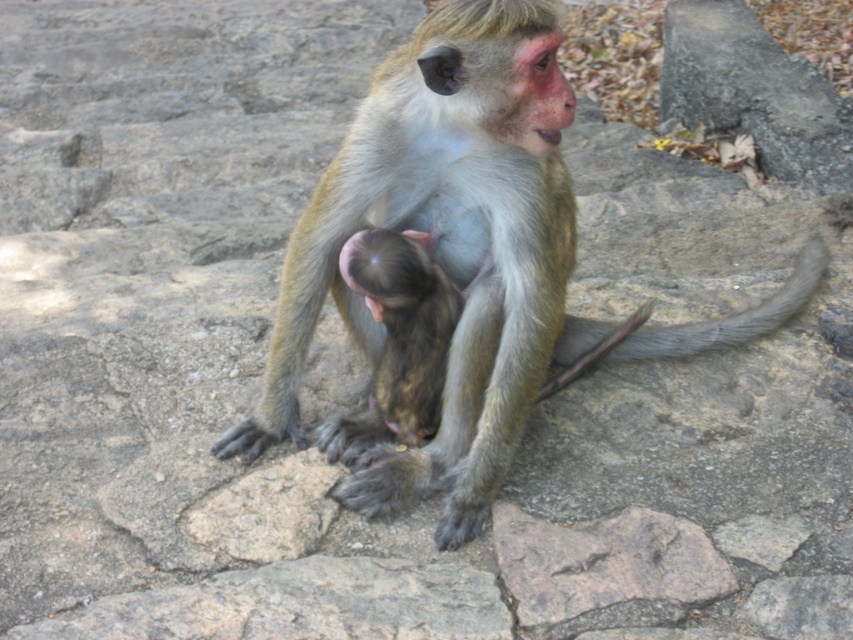
Is point (543, 35) closer to viewer compared to point (384, 257)?

That is True.

Where is `green fur monkey at center`? green fur monkey at center is located at coordinates (445, 248).